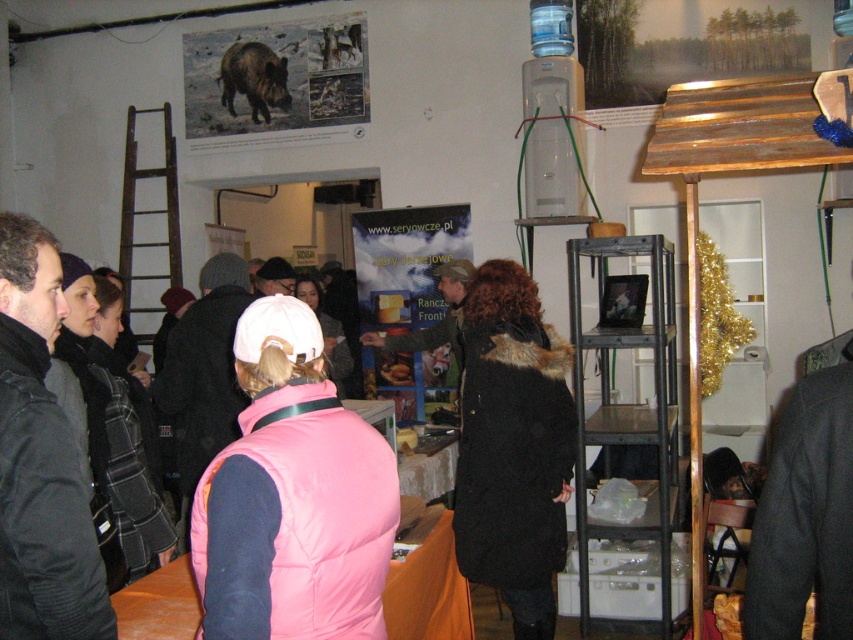
You are standing in the exhibition space and want to locate the pink puffy vest at center. According to the coordinates provided, where exactly is it positioned?

The pink puffy vest at center is located at coordinates point (293, 497).

In the scene, you see a woman wearing a pink puffy vest at center and a poster featuring a brown furry wild boar at upper left. From the perspective of someone standing in the room, which object is positioned more to the right?

The pink puffy vest at center is to the right of the brown furry wild boar at upper left, so the pink puffy vest at center is positioned more to the right.

You are organizing a clothing donation drive and need to determine if the pink puffy vest at center and the black woolen jacket at left can fit into a standard donation box that measures 30x30x30 cm. Given their sizes, will both items fit inside the box?

The pink puffy vest at center is smaller than the black woolen jacket at left. Since the vest is smaller, it might fit into the 30x30x30 cm donation box. However, the black woolen jacket at left may be too large to fit unless it is folded properly. Both items could potentially fit if the jacket is folded to match the vest size, but this depends on their actual dimensions when compressed.